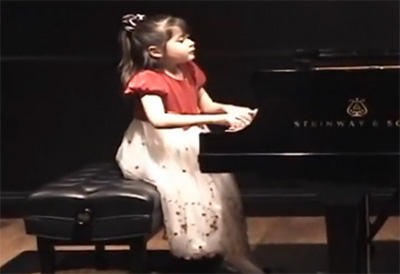
Find the location of a particular element. The height and width of the screenshot is (274, 400). floor is located at coordinates (308, 236).